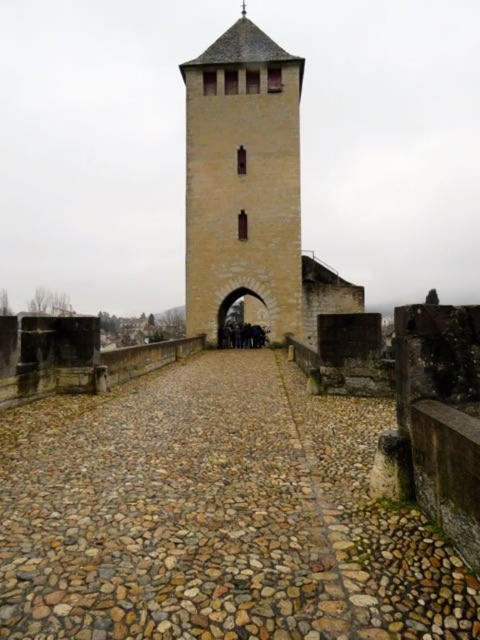
Does brown cobblestone path at center appear on the left side of smooth stone tower at center?

Correct, you'll find brown cobblestone path at center to the left of smooth stone tower at center.

Does brown cobblestone path at center have a greater height compared to smooth stone tower at center?

No.

Locate an element on the screen. brown cobblestone path at center is located at coordinates (216, 515).